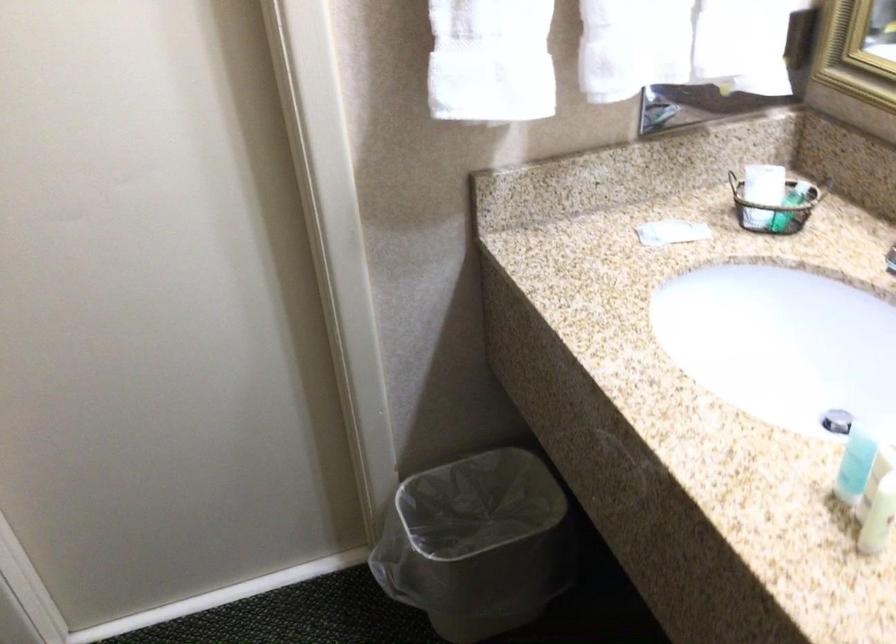
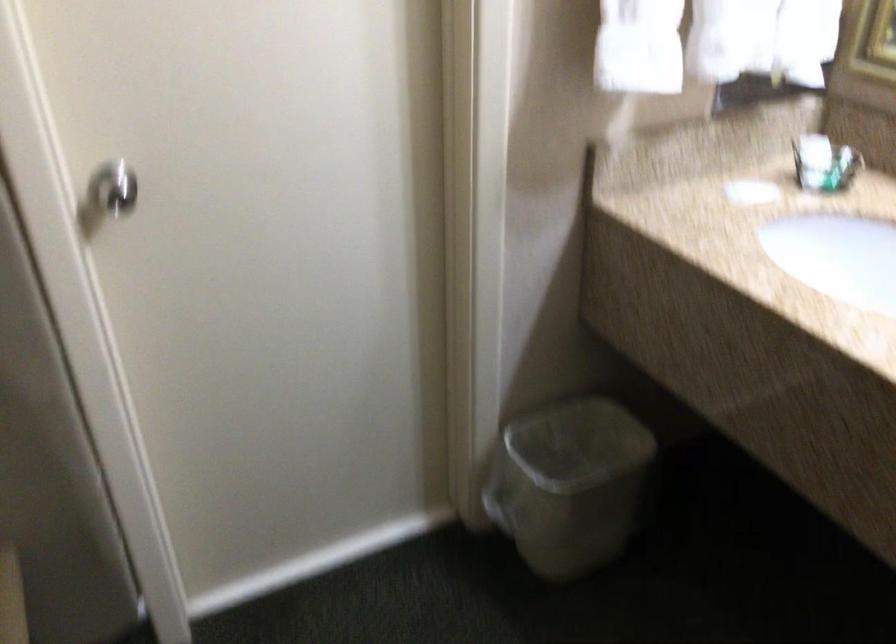
Where in the second image is the point corresponding to the point at 443,560 from the first image?

(570, 484)